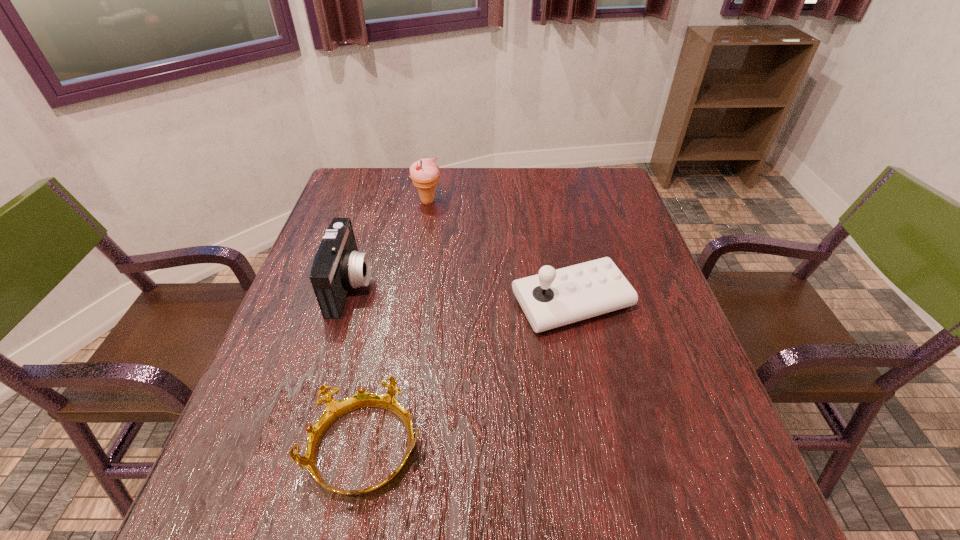
You are a GUI agent. You are given a task and a screenshot of the screen. Output one action in this format:
    pyautogui.click(x=<x>, y=<y>)
    Task: Click on the object located in the near edge section of the desktop
    
    Given the screenshot: What is the action you would take?
    coord(335,409)

This screenshot has width=960, height=540. I want to click on camcorder that is at the left edge, so click(338, 266).

The height and width of the screenshot is (540, 960). What are the coordinates of `crown present at the left edge` in the screenshot? It's located at (335, 409).

The height and width of the screenshot is (540, 960). I want to click on object that is at the right edge, so (x=553, y=298).

You are a GUI agent. You are given a task and a screenshot of the screen. Output one action in this format:
    pyautogui.click(x=<x>, y=<y>)
    Task: Click on the object that is at the near left corner
    The height and width of the screenshot is (540, 960).
    Given the screenshot: What is the action you would take?
    pyautogui.click(x=335, y=409)

This screenshot has height=540, width=960. In order to click on vacant space at the far edge of the desktop in this screenshot , I will do `click(516, 190)`.

Locate an element on the screen. vacant space at the near edge of the desktop is located at coordinates (414, 490).

Identify the location of free space at the left edge of the desktop. This screenshot has width=960, height=540. (244, 430).

In the image, there is a desktop. Where is `free region at the right edge`? free region at the right edge is located at coordinates (594, 229).

Image resolution: width=960 pixels, height=540 pixels. Find the location of `vacant point at the far left corner`. vacant point at the far left corner is located at coordinates (361, 178).